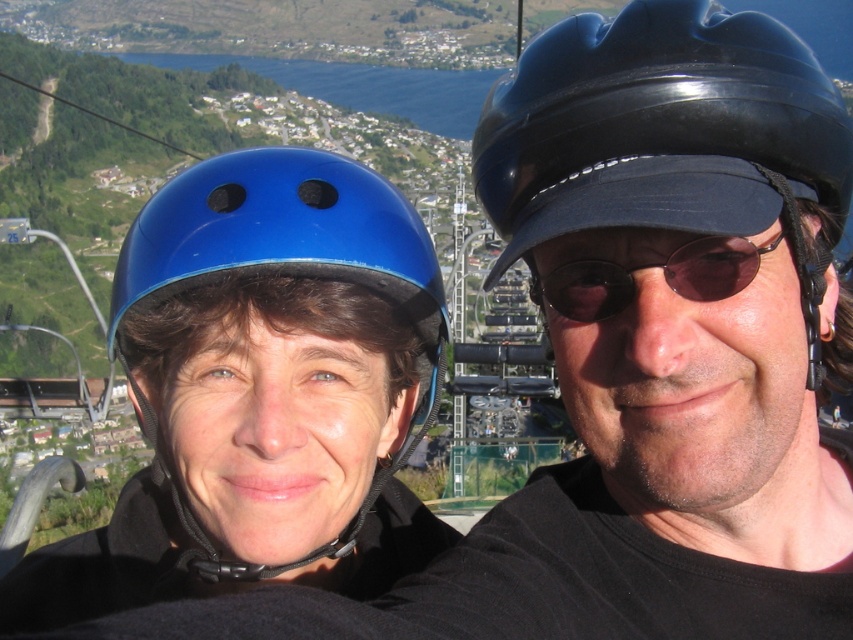
Question: Which object is closer to the camera taking this photo?

Choices:
 (A) blue matte helmet at left
 (B) sunglasses at center

Answer: (B)

Question: Which of these objects is positioned closest to the black glossy helmet at upper center?

Choices:
 (A) blue matte helmet at left
 (B) sunglasses at center

Answer: (B)

Question: Which of the following is the farthest from the observer?

Choices:
 (A) black glossy helmet at upper center
 (B) blue matte helmet at left

Answer: (B)

Question: Does blue matte helmet at left have a smaller size compared to sunglasses at center?

Choices:
 (A) yes
 (B) no

Answer: (B)

Question: Is blue matte helmet at left smaller than sunglasses at center?

Choices:
 (A) no
 (B) yes

Answer: (A)

Question: Does black glossy helmet at upper center come in front of blue matte helmet at left?

Choices:
 (A) yes
 (B) no

Answer: (A)